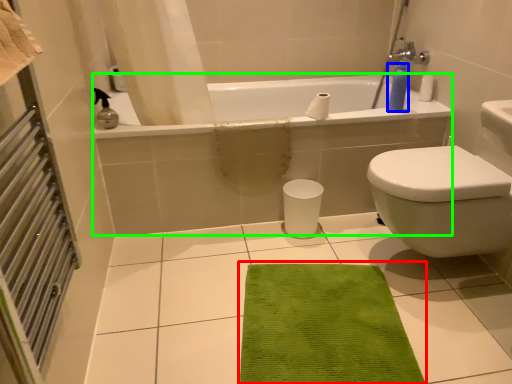
Question: Which is nearer to the doormat (highlighted by a red box)? soap dispenser (highlighted by a blue box) or bath (highlighted by a green box).

Choices:
 (A) soap dispenser
 (B) bath

Answer: (B)